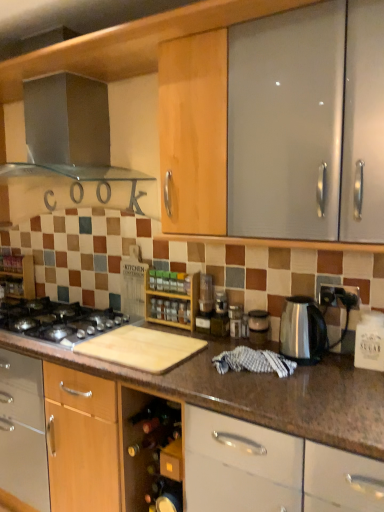
Question: From a real-world perspective, is wooden spice rack at left, acting as the second shelf starting from the front, over transparent plastic container at center, which is the 1th appliance in right-to-left order?

Choices:
 (A) yes
 (B) no

Answer: (A)

Question: Does wooden spice rack at left, positioned as the first shelf in back-to-front order, have a lesser width compared to transparent plastic container at center, which is the 1th appliance in right-to-left order?

Choices:
 (A) yes
 (B) no

Answer: (B)

Question: Is the position of wooden spice rack at left, positioned as the first shelf in back-to-front order, less distant than that of transparent plastic container at center, which is counted as the 2th appliance, starting from the left?

Choices:
 (A) no
 (B) yes

Answer: (A)

Question: Is wooden spice rack at left, which appears as the first shelf when viewed from the left, wider than transparent plastic container at center, which is the 1th appliance in right-to-left order?

Choices:
 (A) yes
 (B) no

Answer: (A)

Question: From the image's perspective, would you say wooden spice rack at left, acting as the second shelf starting from the front, is shown under transparent plastic container at center, which is counted as the 2th appliance, starting from the left?

Choices:
 (A) no
 (B) yes

Answer: (A)

Question: Is point (97, 145) closer or farther from the camera than point (46, 324)?

Choices:
 (A) farther
 (B) closer

Answer: (A)

Question: In terms of width, does stainless steel range hood at upper left, which appears as the second kitchen appliance when ordered from the bottom, look wider or thinner when compared to black matte gas stove at lower left?

Choices:
 (A) thin
 (B) wide

Answer: (A)

Question: From a real-world perspective, is stainless steel range hood at upper left, which is the first kitchen appliance from left to right, physically located above or below black matte gas stove at lower left?

Choices:
 (A) below
 (B) above

Answer: (B)

Question: Is stainless steel range hood at upper left, which is the first kitchen appliance from left to right, taller or shorter than black matte gas stove at lower left?

Choices:
 (A) tall
 (B) short

Answer: (A)

Question: From a real-world perspective, is wooden spice rack at left, positioned as the first shelf in back-to-front order, above or below metallic silver blender at center, positioned as the 2th appliance in right-to-left order?

Choices:
 (A) above
 (B) below

Answer: (A)

Question: Based on their sizes in the image, would you say wooden spice rack at left, arranged as the second shelf when viewed from the right, is bigger or smaller than metallic silver blender at center, positioned as the 2th appliance in right-to-left order?

Choices:
 (A) small
 (B) big

Answer: (B)

Question: In terms of height, does wooden spice rack at left, arranged as the second shelf when viewed from the right, look taller or shorter compared to metallic silver blender at center, positioned as the 2th appliance in right-to-left order?

Choices:
 (A) tall
 (B) short

Answer: (A)

Question: Considering the relative positions of wooden spice rack at left, arranged as the second shelf when viewed from the right, and metallic silver blender at center, which ranks as the 1th appliance in left-to-right order, in the image provided, is wooden spice rack at left, arranged as the second shelf when viewed from the right, to the left or to the right of metallic silver blender at center, which ranks as the 1th appliance in left-to-right order,?

Choices:
 (A) left
 (B) right

Answer: (A)

Question: Relative to black matte gas stove at lower left, is transparent plastic container at center, which is counted as the 2th appliance, starting from the left, in front or behind?

Choices:
 (A) behind
 (B) front

Answer: (A)

Question: Considering the positions of transparent plastic container at center, which is counted as the 2th appliance, starting from the left, and black matte gas stove at lower left in the image, is transparent plastic container at center, which is counted as the 2th appliance, starting from the left, bigger or smaller than black matte gas stove at lower left?

Choices:
 (A) small
 (B) big

Answer: (A)